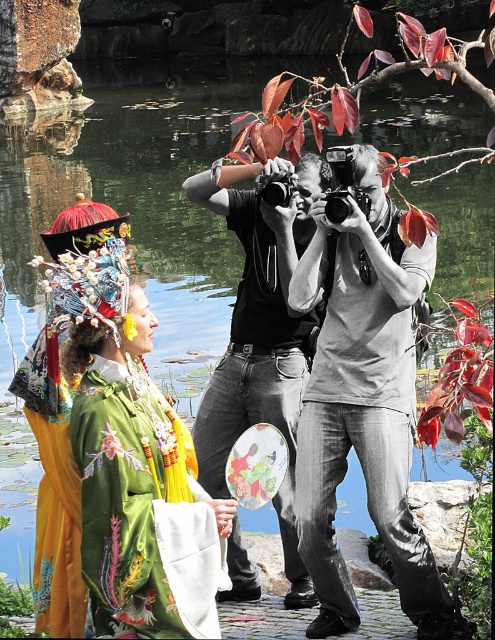
What do you see at coordinates (363, 403) in the screenshot?
I see `gray cotton t-shirt at center` at bounding box center [363, 403].

This screenshot has width=495, height=640. I want to click on gray cotton t-shirt at center, so click(363, 403).

Between point (326, 380) and point (102, 518), which one is positioned behind?

Point (326, 380)

Does point (408, 310) come in front of point (161, 573)?

No, it is behind (161, 573).

You are a GUI agent. You are given a task and a screenshot of the screen. Output one action in this format:
    pyautogui.click(x=<x>, y=<y>)
    Task: Click on the gray cotton t-shirt at center
    
    Given the screenshot: What is the action you would take?
    pyautogui.click(x=363, y=403)

Is green satin robe at center shorter than matte black camera at center?

Incorrect, green satin robe at center's height does not fall short of matte black camera at center's.

Which is in front, point (114, 483) or point (220, 465)?

Positioned in front is point (114, 483).

Find the location of a particular element. Image resolution: width=495 pixels, height=640 pixels. green satin robe at center is located at coordinates (141, 509).